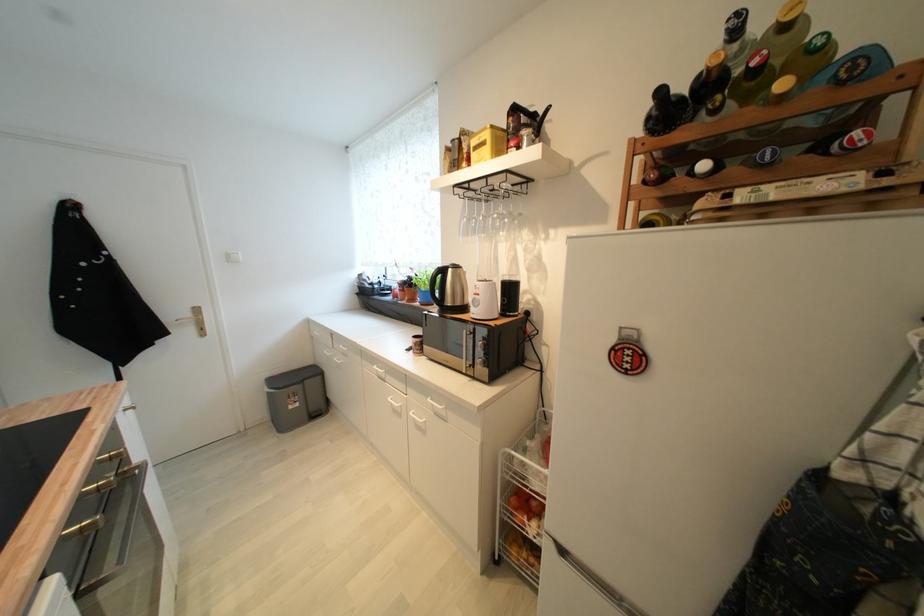
The image size is (924, 616). Identify the location of refrigerator handle. (719, 514).